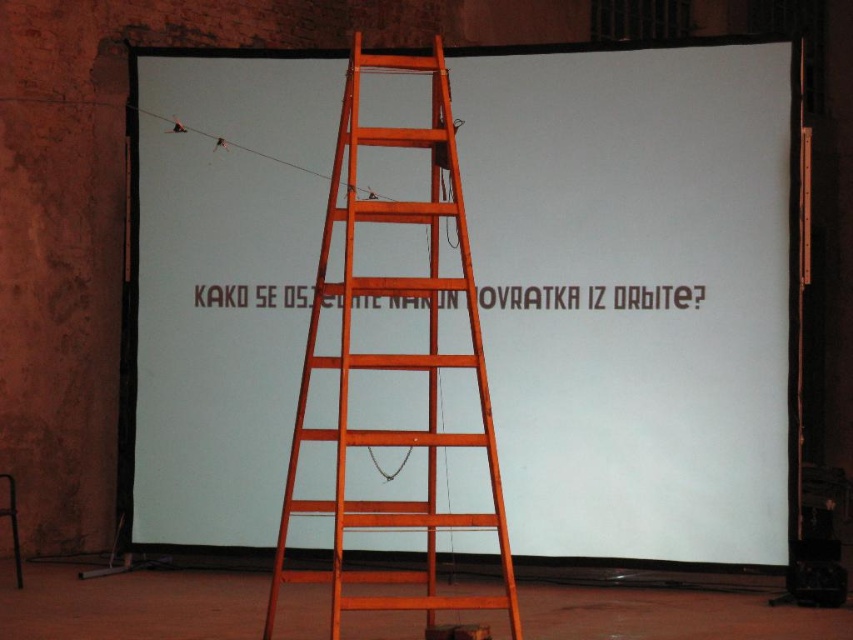
Question: Among these points, which one is nearest to the camera?

Choices:
 (A) (344, 458)
 (B) (660, 205)

Answer: (A)

Question: Is the position of white matte projection screen at center more distant than that of wooden ladder at center?

Choices:
 (A) yes
 (B) no

Answer: (A)

Question: Considering the relative positions of white matte projection screen at center and wooden ladder at center in the image provided, where is white matte projection screen at center located with respect to wooden ladder at center?

Choices:
 (A) right
 (B) left

Answer: (A)

Question: Is white matte projection screen at center below wooden ladder at center?

Choices:
 (A) yes
 (B) no

Answer: (B)

Question: Which of the following is the closest to the observer?

Choices:
 (A) wooden ladder at center
 (B) white matte projection screen at center

Answer: (A)